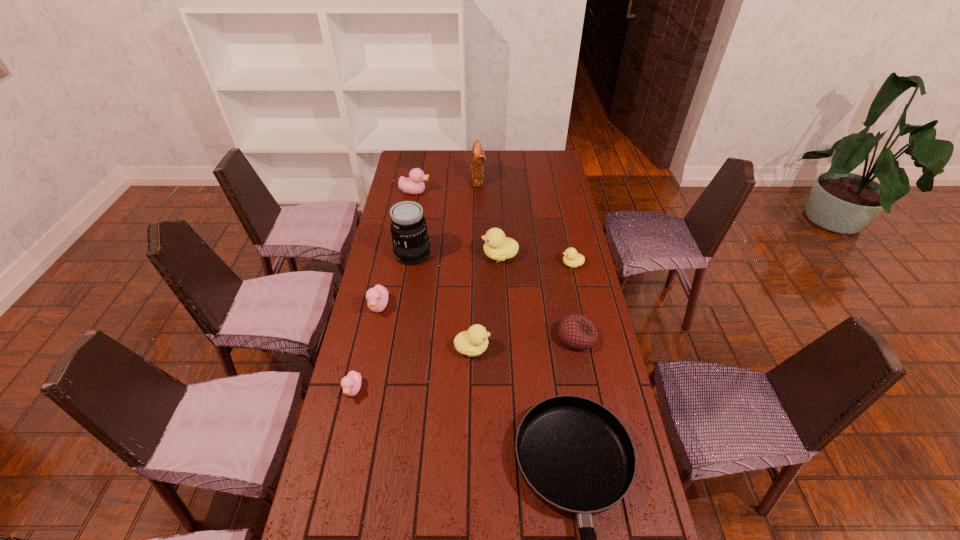
Identify the location of unoccupied area between the telephoto lens and the second nearest pink duckling. coord(396,280).

Find the location of a particular element. The image size is (960, 540). free space between the second smallest yellow duckling and the tallest object is located at coordinates (443, 301).

This screenshot has height=540, width=960. What are the coordinates of `vacant space that's between the ninth shortest object and the rightmost yellow duckling` in the screenshot? It's located at (525, 222).

Identify which object is the eighth nearest to the biggest yellow duckling. Please provide its 2D coordinates. Your answer should be formatted as a tuple, i.e. [(x, y)], where the tuple contains the x and y coordinates of a point satisfying the conditions above.

[(575, 455)]

Point out which object is positioned as the eighth nearest to the beanbag. Please provide its 2D coordinates. Your answer should be formatted as a tuple, i.e. [(x, y)], where the tuple contains the x and y coordinates of a point satisfying the conditions above.

[(477, 157)]

Locate an element on the screen. duckling identified as the fourth closest to the nearest yellow duckling is located at coordinates (571, 258).

The height and width of the screenshot is (540, 960). I want to click on duckling that is the third closest to the second tallest object, so click(x=571, y=258).

Locate which yellow duckling is the third closest to the smallest pink duckling. Please provide its 2D coordinates. Your answer should be formatted as a tuple, i.e. [(x, y)], where the tuple contains the x and y coordinates of a point satisfying the conditions above.

[(571, 258)]

The width and height of the screenshot is (960, 540). I want to click on the third closest yellow duckling relative to the farthest duckling, so click(x=473, y=342).

Identify the location of the second closest pink duckling to the second tallest object. (377, 297).